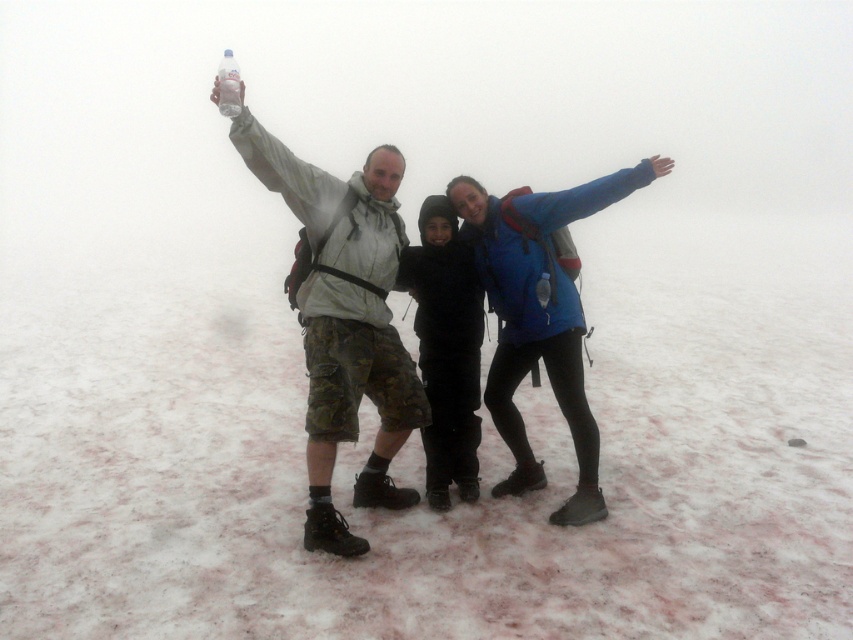
Does white fluffy snow at center have a smaller size compared to matte gray jacket at center?

Incorrect, white fluffy snow at center is not smaller in size than matte gray jacket at center.

Does point (408, 620) come closer to viewer compared to point (235, 134)?

Yes, it is.

Locate an element on the screen. The width and height of the screenshot is (853, 640). white fluffy snow at center is located at coordinates (422, 500).

Who is higher up, white fluffy snow at center or blue matte jacket at center?

blue matte jacket at center is higher up.

Which is more to the left, white fluffy snow at center or blue matte jacket at center?

Positioned to the left is white fluffy snow at center.

This screenshot has width=853, height=640. In order to click on white fluffy snow at center in this screenshot , I will do `click(422, 500)`.

In the scene shown: Can you confirm if matte gray jacket at center is positioned below blue matte jacket at center?

No.

This screenshot has width=853, height=640. I want to click on matte gray jacket at center, so click(345, 321).

Locate an element on the screen. This screenshot has height=640, width=853. matte gray jacket at center is located at coordinates (345, 321).

I want to click on matte gray jacket at center, so click(345, 321).